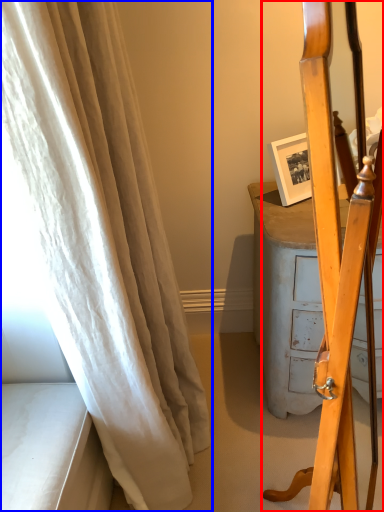
Question: Among these objects, which one is nearest to the camera, furniture (highlighted by a red box) or curtain (highlighted by a blue box)?

Choices:
 (A) furniture
 (B) curtain

Answer: (A)